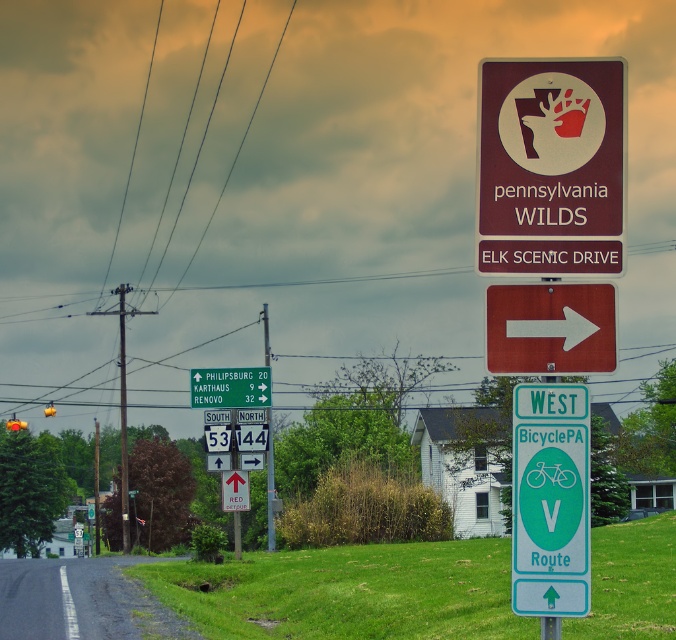
Does green plastic road sign at upper center appear on the left side of metallic signpost at center?

No, green plastic road sign at upper center is not to the left of metallic signpost at center.

Image resolution: width=676 pixels, height=640 pixels. What do you see at coordinates (231, 387) in the screenshot? I see `green plastic road sign at upper center` at bounding box center [231, 387].

Is point (256, 390) closer to viewer compared to point (262, 320)?

That is True.

The height and width of the screenshot is (640, 676). In order to click on green plastic road sign at upper center in this screenshot , I will do `click(231, 387)`.

Which is in front, point (535, 499) or point (268, 522)?

Point (535, 499) is more forward.

Does green plastic bicycle sign at right appear on the right side of metallic signpost at center?

Correct, you'll find green plastic bicycle sign at right to the right of metallic signpost at center.

What do you see at coordinates (550, 499) in the screenshot?
I see `green plastic bicycle sign at right` at bounding box center [550, 499].

I want to click on green plastic bicycle sign at right, so click(x=550, y=499).

Which is below, maroon plastic sign at upper right or metallic signpost at center?

metallic signpost at center is lower down.

Can you confirm if maroon plastic sign at upper right is positioned to the left of metallic signpost at center?

Incorrect, maroon plastic sign at upper right is not on the left side of metallic signpost at center.

What are the coordinates of `maroon plastic sign at upper right` in the screenshot? It's located at (552, 164).